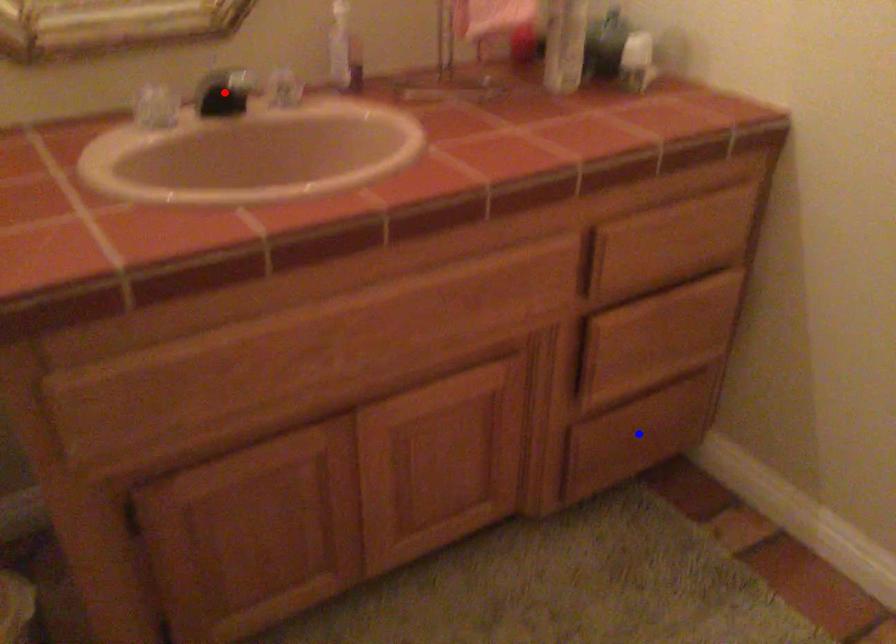
Question: Which of the two points in the image is closer to the camera?

Choices:
 (A) Blue point is closer.
 (B) Red point is closer.

Answer: (B)